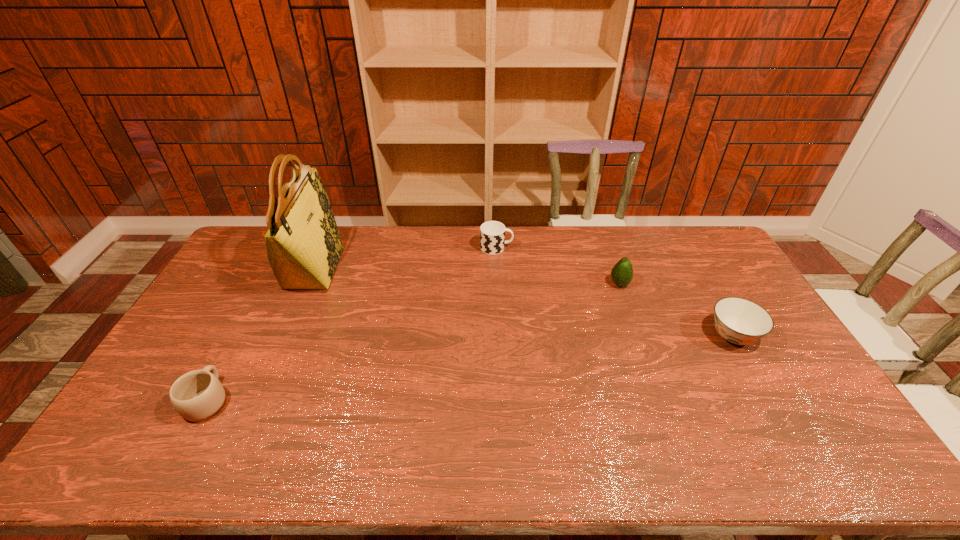
The image size is (960, 540). Find the location of `empty space between the fourth farthest object and the tote bag`. empty space between the fourth farthest object and the tote bag is located at coordinates (523, 302).

At what (x,y) coordinates should I click in order to perform the action: click on unoccupied area between the tallest object and the nearest object. Please return your answer as a coordinate pair (x, y). The image size is (960, 540). Looking at the image, I should click on (261, 334).

What are the coordinates of `free space between the nearest object and the tallest object` in the screenshot? It's located at (261, 334).

Identify which object is the second closest to the tote bag. Please provide its 2D coordinates. Your answer should be formatted as a tuple, i.e. [(x, y)], where the tuple contains the x and y coordinates of a point satisfying the conditions above.

[(492, 233)]

Image resolution: width=960 pixels, height=540 pixels. In order to click on object that is the fourth closest to the tallest object in this screenshot , I will do `click(739, 321)`.

Find the location of a particular element. This screenshot has height=540, width=960. free region that satisfies the following two spatial constraints: 1. on the front-facing side of the tallest object; 2. on the back side of the fourth farthest object is located at coordinates (284, 336).

This screenshot has width=960, height=540. In order to click on vacant space that satisfies the following two spatial constraints: 1. on the front-facing side of the tote bag; 2. on the right side of the fourth object from left to right in this screenshot , I will do `click(307, 284)`.

Locate an element on the screen. vacant space that satisfies the following two spatial constraints: 1. on the front-facing side of the soup bowl; 2. on the right side of the tote bag is located at coordinates 284,336.

Find the location of a particular element. free space that satisfies the following two spatial constraints: 1. on the side of the third object from left to right with the handle; 2. on the back side of the fourth object from left to right is located at coordinates (498, 284).

Where is `vacant space that satisfies the following two spatial constraints: 1. on the side of the soup bowl with the handle; 2. on the left side of the third object from right to left`? Image resolution: width=960 pixels, height=540 pixels. vacant space that satisfies the following two spatial constraints: 1. on the side of the soup bowl with the handle; 2. on the left side of the third object from right to left is located at coordinates (501, 336).